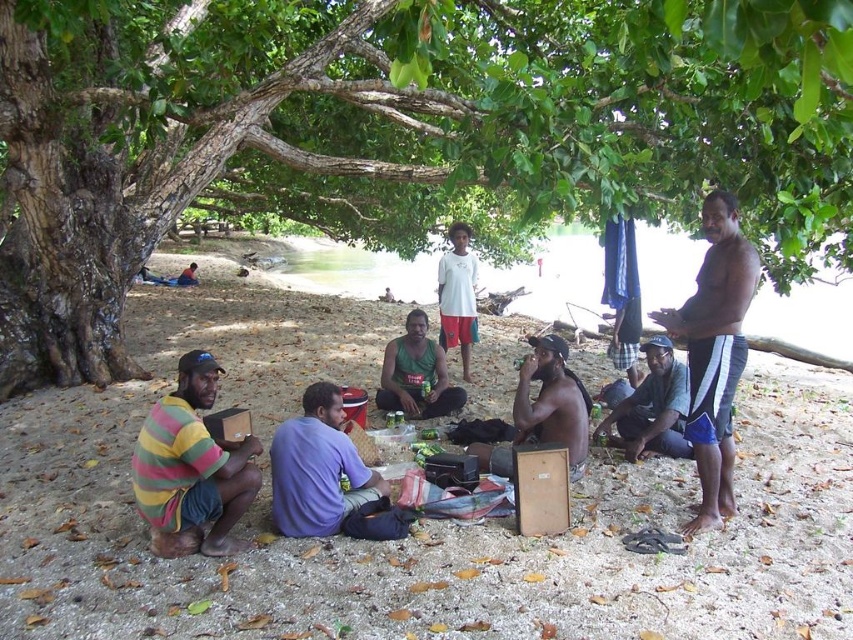
Question: Which object is farther from the camera taking this photo?

Choices:
 (A) shiny black skin at center
 (B) matte black cap at lower right
 (C) green leafy tree at center
 (D) brown skin at right

Answer: (B)

Question: Which point is farther to the camera?

Choices:
 (A) (67, 97)
 (B) (726, 486)
 (C) (550, 436)
 (D) (318, 493)

Answer: (A)

Question: Does brown sand at lower center have a greater width compared to purple fabric shirt at center?

Choices:
 (A) no
 (B) yes

Answer: (B)

Question: Does green leafy tree at center appear on the right side of brown sand at lower center?

Choices:
 (A) no
 (B) yes

Answer: (A)

Question: Among these points, which one is nearest to the camera?

Choices:
 (A) (560, 413)
 (B) (416, 387)

Answer: (A)

Question: Can you confirm if brown sand at lower center is smaller than brown skin at right?

Choices:
 (A) yes
 (B) no

Answer: (B)